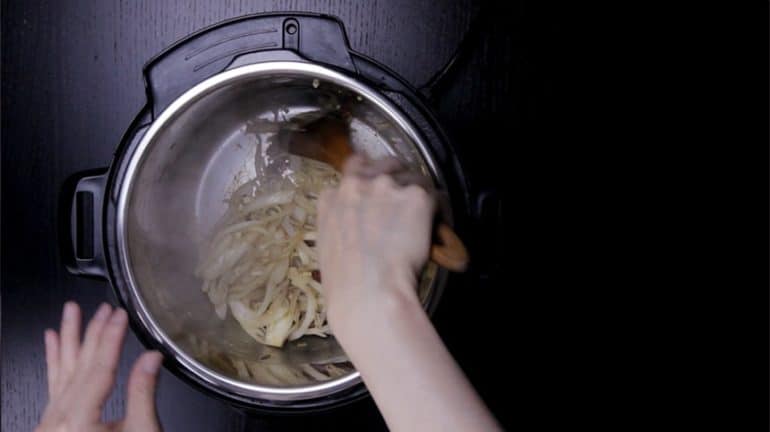
Locate an element on the screen. handle is located at coordinates (92, 178).